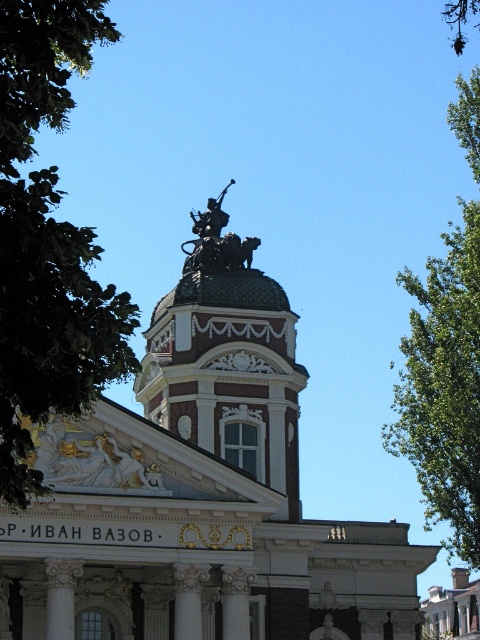
Is polished bronze statue at center wider than bronze statue at center?

Correct, the width of polished bronze statue at center exceeds that of bronze statue at center.

How much distance is there between polished bronze statue at center and bronze statue at center?

polished bronze statue at center and bronze statue at center are 11.71 feet apart.

What do you see at coordinates (227, 358) in the screenshot? I see `polished bronze statue at center` at bounding box center [227, 358].

Locate an element on the screen. The width and height of the screenshot is (480, 640). polished bronze statue at center is located at coordinates (227, 358).

Is polished bronze statue at upper center positioned in front of bronze statue at center?

That is True.

Is point (115, 547) less distant than point (227, 237)?

Yes, point (115, 547) is closer to viewer.

Where is `polished bronze statue at upper center`? The width and height of the screenshot is (480, 640). polished bronze statue at upper center is located at coordinates (199, 499).

Which is above, green leafy tree at upper right or bronze statue at center?

bronze statue at center is higher up.

Measure the distance from green leafy tree at upper right to bronze statue at center.

The distance of green leafy tree at upper right from bronze statue at center is 13.42 meters.

This screenshot has width=480, height=640. Identify the location of green leafy tree at upper right. (444, 387).

The image size is (480, 640). Identify the location of green leafy tree at upper right. (444, 387).